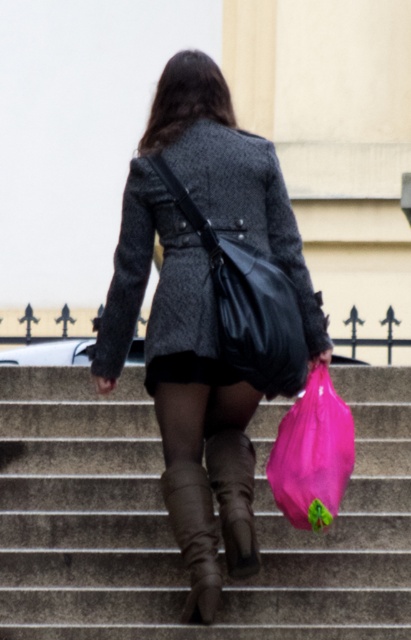
Who is more distant from viewer, (233,259) or (196,486)?

The point (233,259) is behind.

Identify the location of black leather bag at center. (247, 305).

Does matte black coat at center have a greater height compared to pink plastic bag at lower center?

Yes, matte black coat at center is taller than pink plastic bag at lower center.

Who is more forward, (205,600) or (311,483)?

Positioned in front is point (205,600).

What are the coordinates of `matte black coat at center` in the screenshot? It's located at (200, 310).

Can you confirm if concrete stairs at center is positioned to the right of brown suede boot at center?

Incorrect, concrete stairs at center is not on the right side of brown suede boot at center.

Which is behind, point (397, 440) or point (230, 461)?

The point (397, 440) is more distant.

At what (x,y) coordinates should I click in order to perform the action: click on concrete stairs at center. Please return your answer as a coordinate pair (x, y). The width and height of the screenshot is (411, 640). Looking at the image, I should click on pos(168,524).